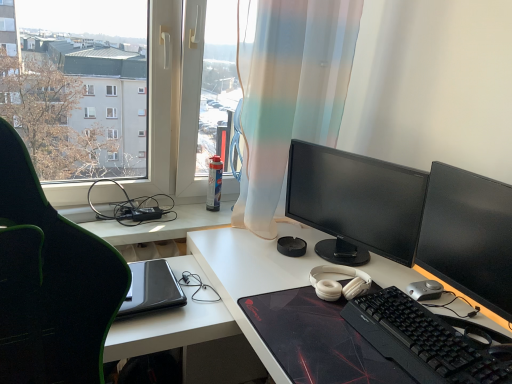
Where is `vacant point to the right of silver metallic mouse at lower right`? The image size is (512, 384). vacant point to the right of silver metallic mouse at lower right is located at coordinates (461, 302).